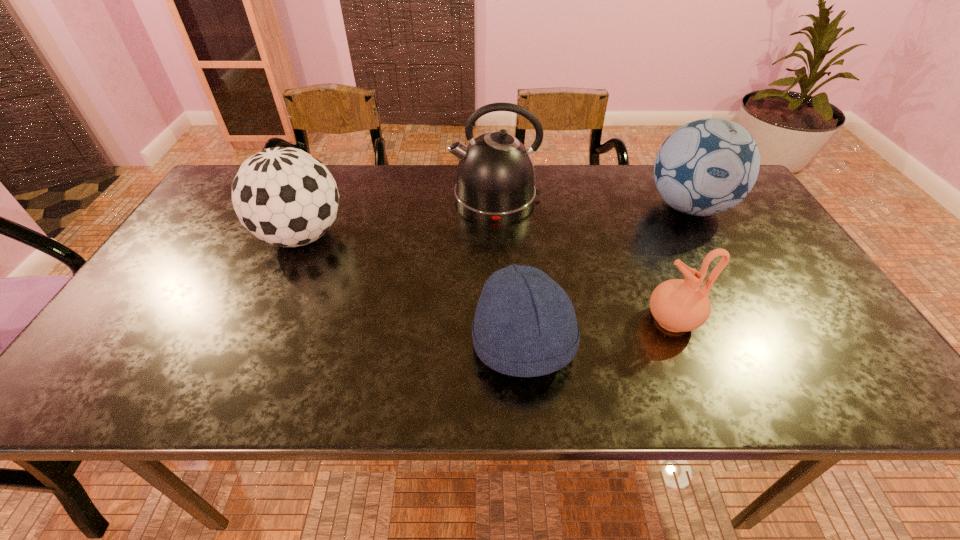
Where is `kettle`? The image size is (960, 540). kettle is located at coordinates (495, 176).

Identify the location of the right soccer ball. tap(705, 167).

Locate an element on the screen. Image resolution: width=960 pixels, height=540 pixels. the leftmost object is located at coordinates (284, 196).

Locate an element on the screen. Image resolution: width=960 pixels, height=540 pixels. pottery is located at coordinates (678, 305).

This screenshot has height=540, width=960. Identify the location of the shortest object. (525, 325).

Find the location of a particular element. blank area located 0.320m on the spout of the kettle is located at coordinates (343, 197).

At what (x,y) coordinates should I click in order to perform the action: click on free spot located on the spout of the kettle. Please return your answer as a coordinate pair (x, y). This screenshot has width=960, height=540. Looking at the image, I should click on (336, 197).

Locate an element on the screen. This screenshot has height=540, width=960. free region located 0.250m on the spout of the kettle is located at coordinates (367, 197).

Where is `vacant area situated 0.120m on the side with brand of the right soccer ball`? This screenshot has width=960, height=540. vacant area situated 0.120m on the side with brand of the right soccer ball is located at coordinates pos(722,266).

The height and width of the screenshot is (540, 960). Find the location of `vacant space positioned 0.200m on the right of the leftmost object`. vacant space positioned 0.200m on the right of the leftmost object is located at coordinates (420, 236).